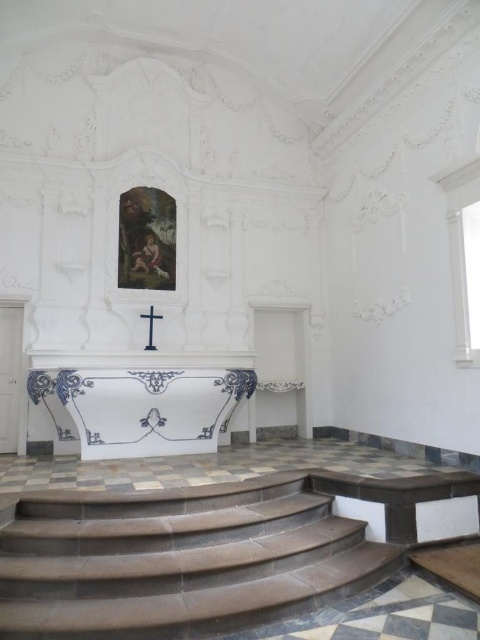
Question: Which point appears farthest from the camera in this image?

Choices:
 (A) (148, 337)
 (B) (128, 397)

Answer: (A)

Question: Which of these objects is positioned farthest from the brown stone stairs at lower center?

Choices:
 (A) blue and white porcelain altar at center
 (B) black wood cross at center

Answer: (B)

Question: Is the position of blue and white porcelain altar at center more distant than that of black wood cross at center?

Choices:
 (A) yes
 (B) no

Answer: (B)

Question: Can you confirm if brown stone stairs at lower center is positioned to the right of blue and white porcelain altar at center?

Choices:
 (A) no
 (B) yes

Answer: (B)

Question: Can you confirm if brown stone stairs at lower center is positioned to the left of blue and white porcelain altar at center?

Choices:
 (A) no
 (B) yes

Answer: (A)

Question: Which point is closer to the camera?

Choices:
 (A) (247, 500)
 (B) (146, 314)

Answer: (A)